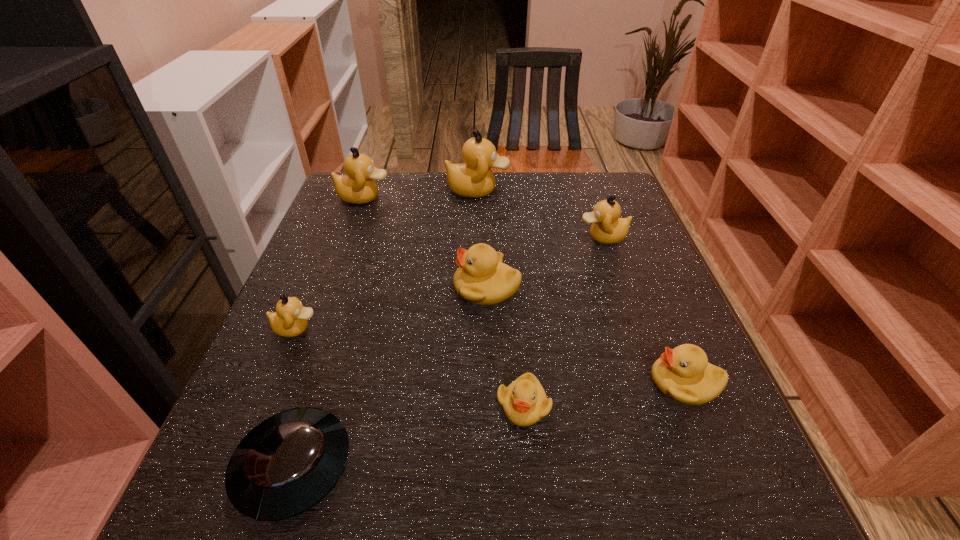
Where is `free spot located 0.180m at the face of the fifth nearest object`? The image size is (960, 540). free spot located 0.180m at the face of the fifth nearest object is located at coordinates (371, 288).

The image size is (960, 540). In order to click on vacant space situated on the face of the smallest tan duckling in this screenshot , I will do `click(495, 328)`.

At what (x,y) coordinates should I click in order to perform the action: click on vacant space situated 0.110m at the face of the second smallest yellow duckling. Please return your answer as a coordinate pair (x, y). This screenshot has height=540, width=960. Looking at the image, I should click on [588, 382].

Find the location of `free space located 0.220m at the face of the second smallest yellow duckling`. free space located 0.220m at the face of the second smallest yellow duckling is located at coordinates (526, 382).

The image size is (960, 540). In order to click on vacant space situated at the face of the second smallest yellow duckling in this screenshot , I will do `click(543, 382)`.

Identify the location of blank area located at the face of the shortest duckling. This screenshot has width=960, height=540. tap(534, 530).

The width and height of the screenshot is (960, 540). Find the location of `vacant space located 0.130m on the right of the gray saucer`. vacant space located 0.130m on the right of the gray saucer is located at coordinates (437, 467).

Where is `object located in the near edge section of the desktop`? This screenshot has width=960, height=540. object located in the near edge section of the desktop is located at coordinates (288, 463).

Find the location of `saucer at the left edge`. saucer at the left edge is located at coordinates (288, 463).

I want to click on object positioned at the far left corner, so click(357, 187).